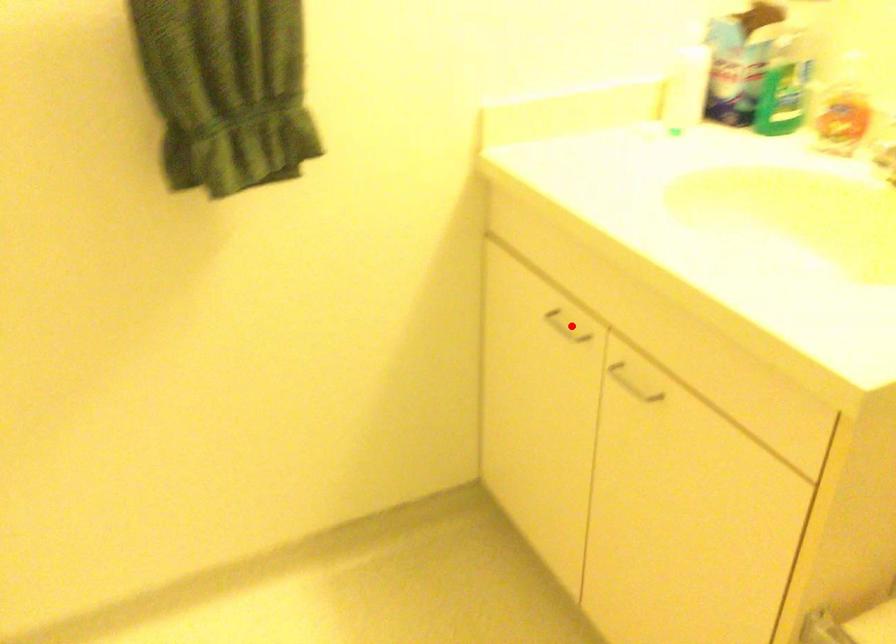
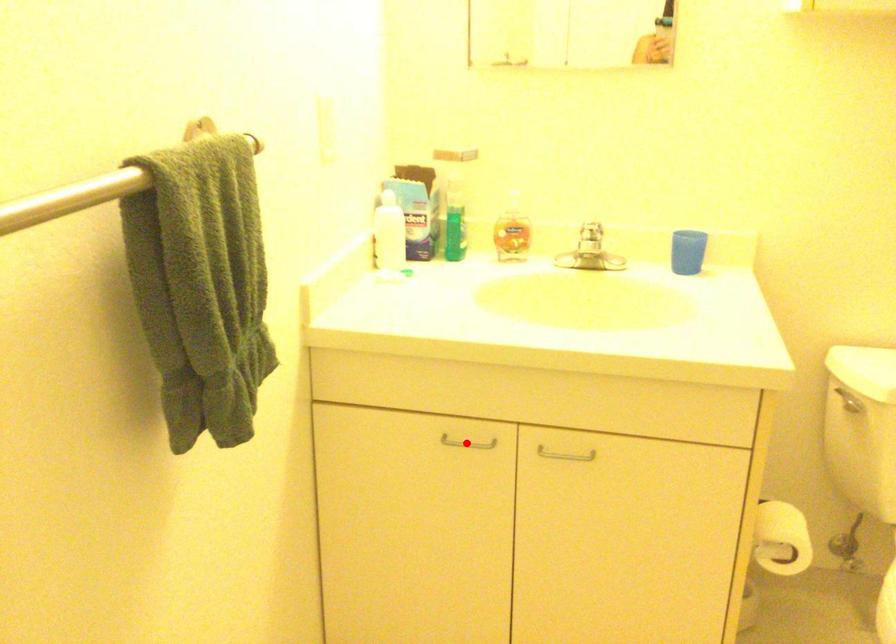
I am providing you with two images of the same scene from different viewpoints. A red point is marked on the first image and another point is marked on the second image. Does the point marked in image1 correspond to the same location as the one in image2?

Yes